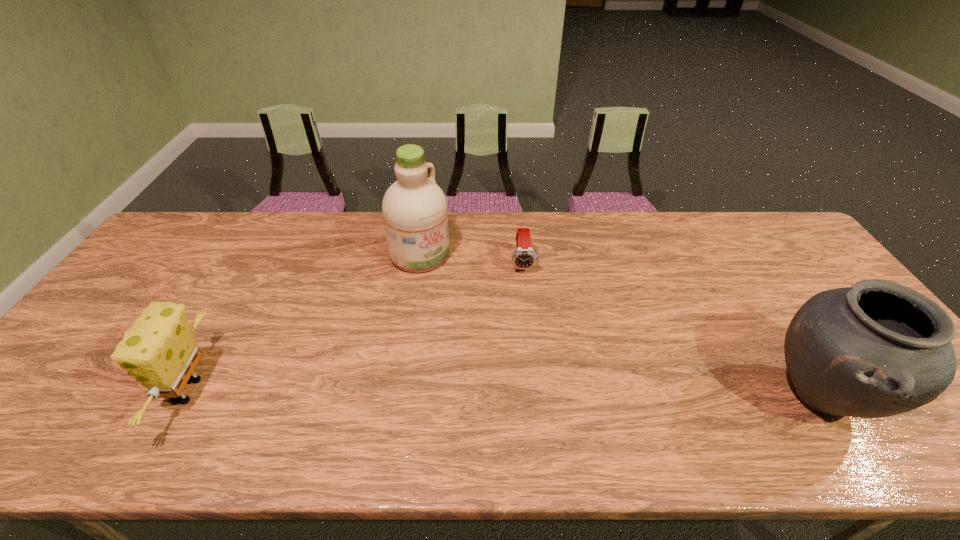
Locate an element on the screen. vacant space located on the face of the leftmost object is located at coordinates (90, 391).

Locate an element on the screen. This screenshot has height=540, width=960. free space located 0.310m on the left of the third shortest object is located at coordinates (632, 396).

Identify the location of vacant point located 0.270m on the front label of the cleansing agent. The image size is (960, 540). (500, 318).

This screenshot has width=960, height=540. What are the coordinates of `vacant region located on the front label of the cleansing agent` in the screenshot? It's located at (492, 312).

Locate an element on the screen. blank space located 0.390m on the front label of the cleansing agent is located at coordinates (533, 343).

Locate an element on the screen. vacant region located 0.360m on the face of the shortest object is located at coordinates (534, 377).

Where is `vacant area situated on the face of the shortest object`? This screenshot has height=540, width=960. vacant area situated on the face of the shortest object is located at coordinates (527, 310).

I want to click on vacant space situated on the face of the shortest object, so click(x=527, y=310).

You are a GUI agent. You are given a task and a screenshot of the screen. Output one action in this format:
    pyautogui.click(x=<x>, y=<y>)
    Task: Click on the cleansing agent that is at the far edge
    The image size is (960, 540).
    Given the screenshot: What is the action you would take?
    pyautogui.click(x=415, y=211)

Find the location of a particular element. watch that is positioned at the far edge is located at coordinates (524, 257).